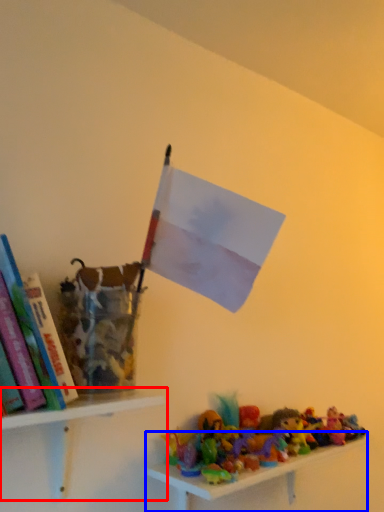
Question: Which object is closer to the camera taking this photo, shelf (highlighted by a red box) or shelf (highlighted by a blue box)?

Choices:
 (A) shelf
 (B) shelf

Answer: (A)